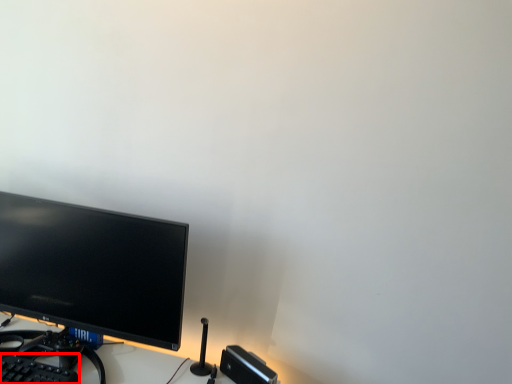
Question: In this image, where is computer keyboard (annotated by the red box) located relative to computer monitor?

Choices:
 (A) right
 (B) left

Answer: (B)